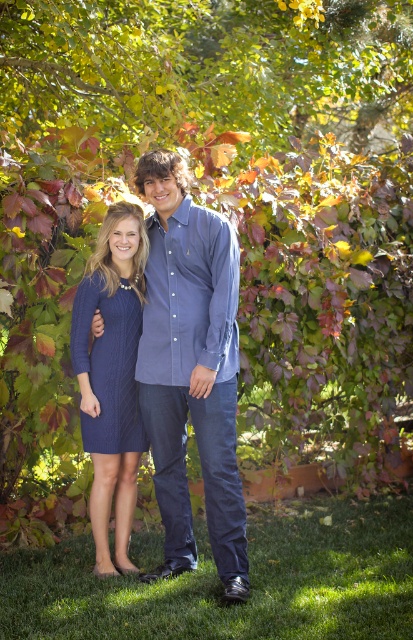
Question: Based on their relative distances, which object is nearer to the blue textured dress at center?

Choices:
 (A) green grass at lower center
 (B) navy cable-knit dress at center

Answer: (B)

Question: From the image, what is the correct spatial relationship of blue textured dress at center in relation to navy cable-knit dress at center?

Choices:
 (A) right
 (B) left

Answer: (A)

Question: Which of the following is the closest to the observer?

Choices:
 (A) (128, 396)
 (B) (351, 540)
 (C) (170, 385)

Answer: (C)

Question: Does blue textured dress at center have a greater width compared to navy cable-knit dress at center?

Choices:
 (A) no
 (B) yes

Answer: (B)

Question: Can you confirm if green grass at lower center is positioned below navy cable-knit dress at center?

Choices:
 (A) no
 (B) yes

Answer: (B)

Question: Which of the following is the closest to the observer?

Choices:
 (A) (80, 426)
 (B) (149, 285)

Answer: (B)